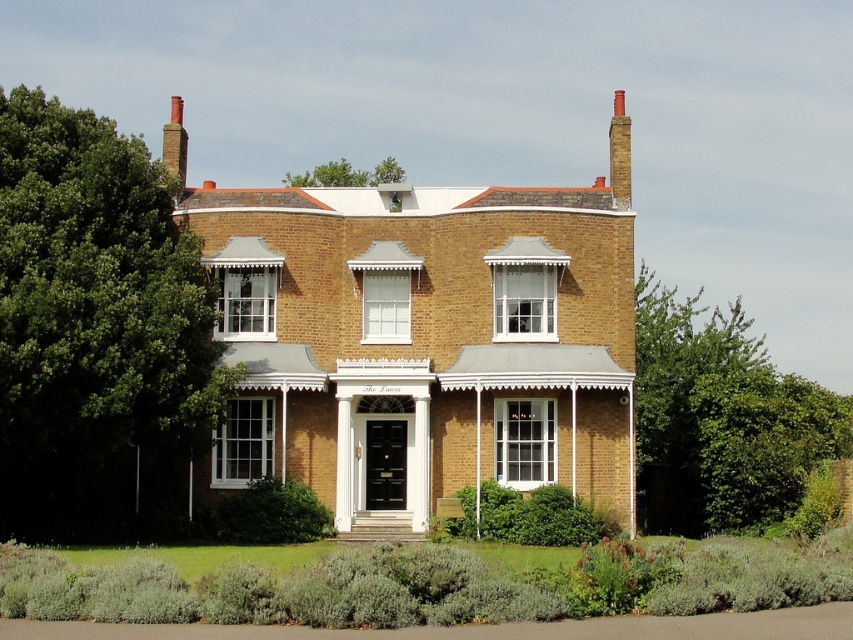
Question: Which point is farther to the camera?

Choices:
 (A) (670, 436)
 (B) (331, 184)

Answer: (B)

Question: Is white wooden porch at center above green leafy tree at upper center?

Choices:
 (A) no
 (B) yes

Answer: (A)

Question: Is green leafy tree at center to the left of green leafy tree at upper center from the viewer's perspective?

Choices:
 (A) yes
 (B) no

Answer: (B)

Question: Estimate the real-world distances between objects in this image. Which object is closer to the green leafy tree at left?

Choices:
 (A) green leafy tree at center
 (B) white wooden porch at center

Answer: (B)

Question: Can you confirm if green leafy tree at left is positioned to the right of green leafy tree at upper center?

Choices:
 (A) no
 (B) yes

Answer: (A)

Question: Which point appears farthest from the camera in this image?

Choices:
 (A) (722, 413)
 (B) (387, 168)
 (C) (196, 362)
 (D) (360, 538)

Answer: (B)